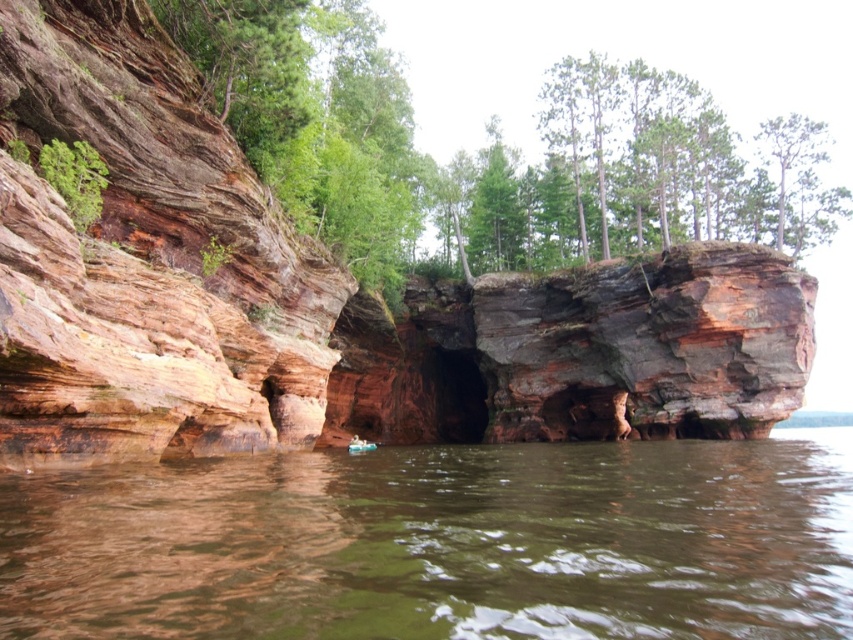
Question: Considering the relative positions of brown sedimentary rock at center and rustic stone cliff at center in the image provided, where is brown sedimentary rock at center located with respect to rustic stone cliff at center?

Choices:
 (A) right
 (B) left

Answer: (A)

Question: Which object is closer to the camera taking this photo?

Choices:
 (A) rustic stone cliff at center
 (B) brown sedimentary rock at center
 (C) green rough bark tree at upper center

Answer: (B)

Question: Is brown sedimentary rock at center smaller than rustic stone cliff at center?

Choices:
 (A) yes
 (B) no

Answer: (B)

Question: Which of the following is the closest to the observer?

Choices:
 (A) (520, 490)
 (B) (737, 141)

Answer: (A)

Question: Is rustic stone cliff at center to the left of green rough bark tree at upper center from the viewer's perspective?

Choices:
 (A) yes
 (B) no

Answer: (A)

Question: Which of these objects is positioned closest to the brown sedimentary rock at center?

Choices:
 (A) green rough bark tree at upper center
 (B) rustic stone cliff at center

Answer: (B)